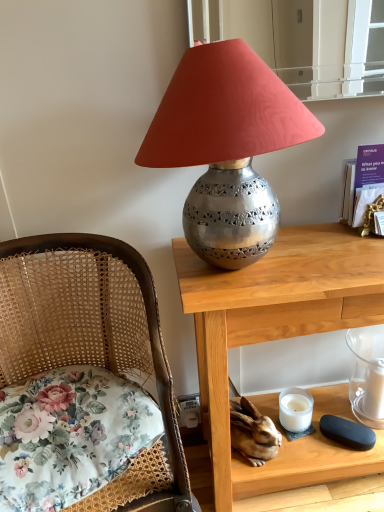
What do you see at coordinates (88, 327) in the screenshot? The image size is (384, 512). I see `woven cane chair at left` at bounding box center [88, 327].

Measure the distance between point [245,65] and camera.

The depth of point [245,65] is 77.40 centimeters.

From the picture: In order to face white matte candle at lower right, should I rotate leftwards or rightwards?

Turn right approximately 23.697 degrees to face it.

What do you see at coordinates (374, 389) in the screenshot? The image size is (384, 512). I see `white matte candle at lower right` at bounding box center [374, 389].

In order to face white matte candle at lower right, which is counted as the 2th candle holder, starting from the right, should I rotate leftwards or rightwards?

To face it directly, rotate right by 13.577 degrees.

Identify the location of woven cane chair at left. (88, 327).

Is metallic silver lampshade at upper center not inside purple paper at upper right?

Yes, metallic silver lampshade at upper center is not within purple paper at upper right.

Based on the photo, considering the relative sizes of metallic silver lampshade at upper center and purple paper at upper right in the image provided, is metallic silver lampshade at upper center taller than purple paper at upper right?

Yes, metallic silver lampshade at upper center is taller than purple paper at upper right.

Consider the image. Is metallic silver lampshade at upper center to the left of purple paper at upper right from the viewer's perspective?

Yes.

Considering the sizes of objects metallic silver lampshade at upper center and purple paper at upper right in the image provided, who is wider, metallic silver lampshade at upper center or purple paper at upper right?

With larger width is metallic silver lampshade at upper center.

Is transparent glass candle at lower right, which is counted as the 2th candle holder, starting from the left, directly adjacent to metallic silver lampshade at upper center?

They are not placed beside each other.

Looking at this image, is transparent glass candle at lower right, acting as the first candle holder starting from the right, not within metallic silver lampshade at upper center?

Yes, transparent glass candle at lower right, acting as the first candle holder starting from the right, is outside of metallic silver lampshade at upper center.

Which object is more forward, transparent glass candle at lower right, acting as the first candle holder starting from the right, or metallic silver lampshade at upper center?

Positioned in front is metallic silver lampshade at upper center.

Identify the location of lamp in front of the transparent glass candle at lower right, which is counted as the 2th candle holder, starting from the left. [x=226, y=146].

In the scene shown: From a real-world perspective, is woven cane chair at left above or below floral fabric cushion at left?

From a real-world perspective, woven cane chair at left is physically below floral fabric cushion at left.

Considering the positions of objects woven cane chair at left and floral fabric cushion at left in the image provided, who is more to the left, woven cane chair at left or floral fabric cushion at left?

woven cane chair at left is more to the left.

In the scene shown: Does woven cane chair at left turn towards floral fabric cushion at left?

Yes, woven cane chair at left faces towards floral fabric cushion at left.

Considering the sizes of woven cane chair at left and floral fabric cushion at left in the image, is woven cane chair at left wider or thinner than floral fabric cushion at left?

Considering their sizes, woven cane chair at left looks broader than floral fabric cushion at left.

From the image's perspective, does white matte candle at lower right appear higher than white matte candle at lower right, which appears as the first candle holder when viewed from the left?

Yes, from the image's perspective, white matte candle at lower right is above white matte candle at lower right, which appears as the first candle holder when viewed from the left.

Can you confirm if white matte candle at lower right is smaller than white matte candle at lower right, which is counted as the 2th candle holder, starting from the right?

Yes, white matte candle at lower right is smaller than white matte candle at lower right, which is counted as the 2th candle holder, starting from the right.

From a real-world perspective, between white matte candle at lower right and white matte candle at lower right, which is counted as the 2th candle holder, starting from the right, who is vertically lower?

white matte candle at lower right, which is counted as the 2th candle holder, starting from the right.

Would you say polished wood desk at center contains woven cane chair at left?

That's incorrect, woven cane chair at left is not inside polished wood desk at center.

Which object is positioned more to the left, polished wood desk at center or woven cane chair at left?

Positioned to the left is woven cane chair at left.

This screenshot has width=384, height=512. Identify the location of chair above the polished wood desk at center (from a real-world perspective). (88, 327).

Is polished wood desk at center aimed at woven cane chair at left?

No, polished wood desk at center is not oriented towards woven cane chair at left.

Is transparent glass candle at lower right, which is counted as the 2th candle holder, starting from the left, taller or shorter than floral fabric cushion at left?

Clearly, transparent glass candle at lower right, which is counted as the 2th candle holder, starting from the left, is taller compared to floral fabric cushion at left.

Could you measure the distance between transparent glass candle at lower right, which is counted as the 2th candle holder, starting from the left, and floral fabric cushion at left?

transparent glass candle at lower right, which is counted as the 2th candle holder, starting from the left, and floral fabric cushion at left are 34.33 inches apart.

Is transparent glass candle at lower right, which is counted as the 2th candle holder, starting from the left, far from floral fabric cushion at left?

No.

Would you say transparent glass candle at lower right, which is counted as the 2th candle holder, starting from the left, is outside floral fabric cushion at left?

Indeed, transparent glass candle at lower right, which is counted as the 2th candle holder, starting from the left, is completely outside floral fabric cushion at left.

Which of these two, purple paper at upper right or metallic silver lampshade at upper center, stands taller?

With more height is metallic silver lampshade at upper center.

Are purple paper at upper right and metallic silver lampshade at upper center far apart?

No.

Considering the points (357, 172) and (196, 130), which point is behind, point (357, 172) or point (196, 130)?

The point (357, 172) is behind.

Locate an element on the screen. book below the metallic silver lampshade at upper center (from a real-world perspective) is located at coordinates (363, 188).

Find the location of a particular element. The height and width of the screenshot is (512, 384). the 1st candle holder behind the metallic silver lampshade at upper center is located at coordinates (367, 374).

Estimate the real-world distances between objects in this image. Which object is further from floral fabric cushion at left, metallic silver lampshade at upper center or polished wood desk at center?

The object further to floral fabric cushion at left is metallic silver lampshade at upper center.

Based on their spatial positions, is white matte candle at lower right, which is counted as the 2th candle holder, starting from the right, or transparent glass candle at lower right, which is counted as the 2th candle holder, starting from the left, further from metallic silver lampshade at upper center?

The object further to metallic silver lampshade at upper center is white matte candle at lower right, which is counted as the 2th candle holder, starting from the right.

When comparing their distances from transparent glass candle at lower right, which is counted as the 2th candle holder, starting from the left, does metallic silver lampshade at upper center or woven cane chair at left seem closer?

Based on the image, metallic silver lampshade at upper center appears to be nearer to transparent glass candle at lower right, which is counted as the 2th candle holder, starting from the left.

Based on their spatial positions, is white matte candle at lower right or floral fabric cushion at left closer to woven cane chair at left?

Among the two, floral fabric cushion at left is located nearer to woven cane chair at left.

In the scene shown: Which object lies nearer to the anchor point floral fabric cushion at left, metallic silver lampshade at upper center or woven cane chair at left?

Among the two, woven cane chair at left is located nearer to floral fabric cushion at left.

Looking at the image, which one is located closer to transparent glass candle at lower right, which is counted as the 2th candle holder, starting from the left, purple paper at upper right or polished wood desk at center?

polished wood desk at center.

Considering their positions, is white matte candle at lower right, which is counted as the 2th candle holder, starting from the right, positioned further to white matte candle at lower right than woven cane chair at left?

woven cane chair at left is further to white matte candle at lower right.

From the image, which object appears to be farther from polished wood desk at center, metallic silver lampshade at upper center or white matte candle at lower right, which is counted as the 2th candle holder, starting from the right?

white matte candle at lower right, which is counted as the 2th candle holder, starting from the right.

Locate an element on the screen. This screenshot has height=512, width=384. desk between purple paper at upper right and white matte candle at lower right, which appears as the first candle holder when viewed from the left, from top to bottom is located at coordinates (277, 339).

What are the coordinates of `book between metallic silver lampshade at upper center and white matte candle at lower right, which appears as the first candle holder when viewed from the left, in the up-down direction` in the screenshot? It's located at (363, 188).

Locate an element on the screen. Image resolution: width=384 pixels, height=512 pixels. desk located between floral fabric cushion at left and transparent glass candle at lower right, which is counted as the 2th candle holder, starting from the left, in the left-right direction is located at coordinates (277, 339).

Image resolution: width=384 pixels, height=512 pixels. I want to click on desk located between woven cane chair at left and transparent glass candle at lower right, acting as the first candle holder starting from the right, in the left-right direction, so click(277, 339).